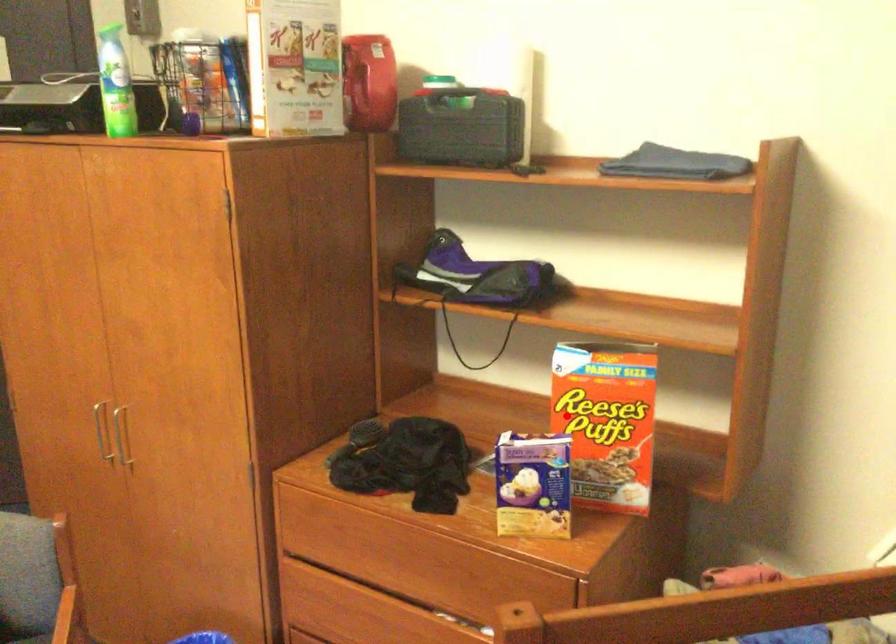
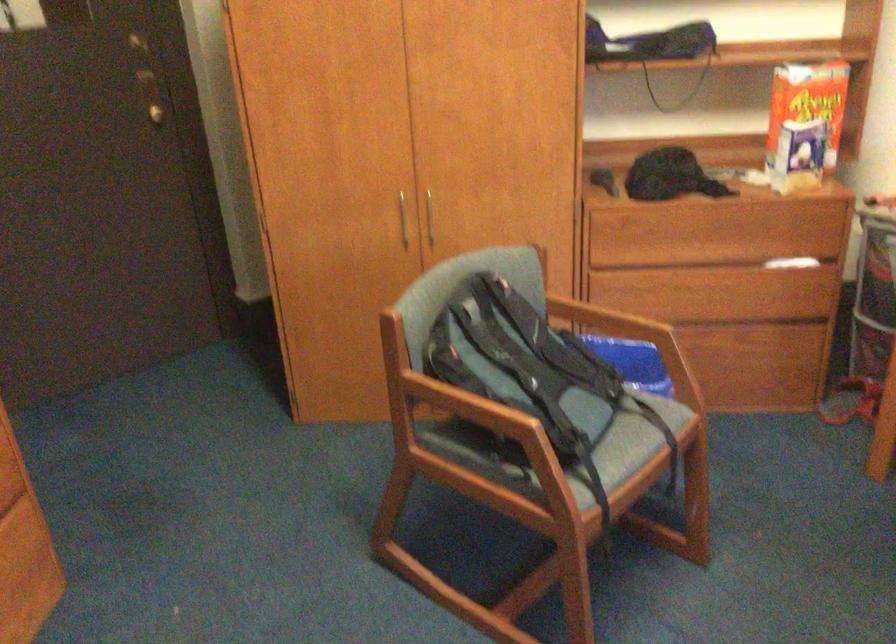
Question: I am providing you with two images of the same scene from different viewpoints. A red point is shown in image1. For the corresponding object point in image2, is it positioned nearer or farther from the camera?

Choices:
 (A) Nearer
 (B) Farther

Answer: (B)